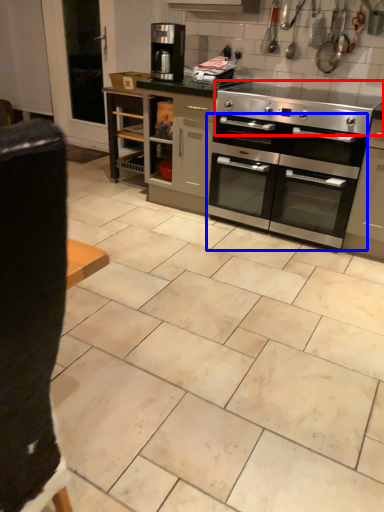
Question: Which of the following is the closest to the observer, gas stove (highlighted by a red box) or oven (highlighted by a blue box)?

Choices:
 (A) gas stove
 (B) oven

Answer: (A)